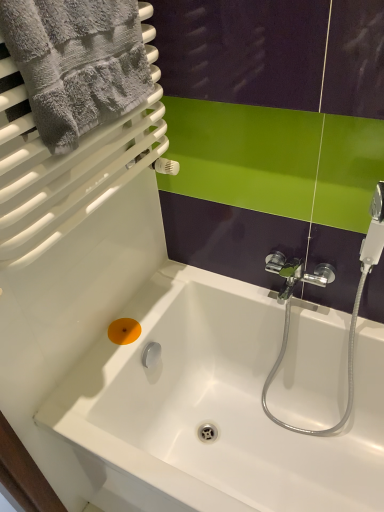
You are a GUI agent. You are given a task and a screenshot of the screen. Output one action in this format:
    pyautogui.click(x=<x>, y=<y>)
    Task: Click on the orange matte soap at lower left
    
    Given the screenshot: What is the action you would take?
    pyautogui.click(x=124, y=331)

The width and height of the screenshot is (384, 512). I want to click on gray fluffy towel at upper left, so click(76, 63).

Between gray fluffy towel at upper left and orange matte soap at lower left, which one is positioned behind?

Positioned behind is orange matte soap at lower left.

Can you confirm if gray fluffy towel at upper left is thinner than orange matte soap at lower left?

No, gray fluffy towel at upper left is not thinner than orange matte soap at lower left.

Measure the distance between gray fluffy towel at upper left and orange matte soap at lower left.

gray fluffy towel at upper left and orange matte soap at lower left are 78.98 centimeters apart.

From the image's perspective, is gray fluffy towel at upper left above or below orange matte soap at lower left?

From the image's perspective, gray fluffy towel at upper left appears above orange matte soap at lower left.

Is gray fluffy towel at upper left located outside white glossy bathtub at center?

Yes, gray fluffy towel at upper left is outside of white glossy bathtub at center.

From the image's perspective, which is above, gray fluffy towel at upper left or white glossy bathtub at center?

gray fluffy towel at upper left.

Can you tell me how much white glossy bathtub at center and gray fluffy towel at upper left differ in facing direction?

They differ by 90 degrees in their facing directions.

From the image's perspective, between white glossy bathtub at center and gray fluffy towel at upper left, which one is located above?

gray fluffy towel at upper left appears higher in the image.

Is white glossy bathtub at center to the left of gray fluffy towel at upper left from the viewer's perspective?

No.

Between white glossy bathtub at center and gray fluffy towel at upper left, which one has smaller size?

Smaller between the two is gray fluffy towel at upper left.

Which object is more forward, orange matte soap at lower left or white glossy bathtub at center?

Positioned in front is white glossy bathtub at center.

Is orange matte soap at lower left situated inside white glossy bathtub at center or outside?

orange matte soap at lower left lies within the bounds of white glossy bathtub at center.

Find the location of a particular element. bathtub located underneath the orange matte soap at lower left (from a real-world perspective) is located at coordinates (217, 406).

From a real-world perspective, is orange matte soap at lower left located higher than white glossy bathtub at center?

Indeed, from a real-world perspective, orange matte soap at lower left stands above white glossy bathtub at center.

Which is more to the left, white glossy bathtub at center or orange matte soap at lower left?

orange matte soap at lower left is more to the left.

Is the depth of white glossy bathtub at center greater than that of orange matte soap at lower left?

No.

From the image's perspective, who appears lower, white glossy bathtub at center or orange matte soap at lower left?

From the image's view, white glossy bathtub at center is below.

Could you tell me if white glossy bathtub at center is turned towards orange matte soap at lower left?

No, white glossy bathtub at center does not turn towards orange matte soap at lower left.

From the image's perspective, is orange matte soap at lower left positioned above or below gray fluffy towel at upper left?

From the image's perspective, orange matte soap at lower left appears below gray fluffy towel at upper left.

Does orange matte soap at lower left appear on the right side of gray fluffy towel at upper left?

Incorrect, orange matte soap at lower left is not on the right side of gray fluffy towel at upper left.

From a real-world perspective, which object stands above the other?

gray fluffy towel at upper left.

Is orange matte soap at lower left oriented away from gray fluffy towel at upper left?

That's not correct — orange matte soap at lower left is not looking away from gray fluffy towel at upper left.

Where is `towel on the right of orange matte soap at lower left`? towel on the right of orange matte soap at lower left is located at coordinates (76, 63).

This screenshot has width=384, height=512. I want to click on towel above the white glossy bathtub at center (from the image's perspective), so click(x=76, y=63).

Considering their positions, is white glossy bathtub at center positioned further to orange matte soap at lower left than gray fluffy towel at upper left?

gray fluffy towel at upper left.

When comparing their distances from gray fluffy towel at upper left, does white glossy bathtub at center or orange matte soap at lower left seem closer?

orange matte soap at lower left lies closer to gray fluffy towel at upper left than the other object.

When comparing their distances from orange matte soap at lower left, does gray fluffy towel at upper left or white glossy bathtub at center seem closer?

Based on the image, white glossy bathtub at center appears to be nearer to orange matte soap at lower left.

Estimate the real-world distances between objects in this image. Which object is closer to gray fluffy towel at upper left, orange matte soap at lower left or white glossy bathtub at center?

Among the two, orange matte soap at lower left is located nearer to gray fluffy towel at upper left.

Based on the photo, from the image, which object appears to be nearer to white glossy bathtub at center, gray fluffy towel at upper left or orange matte soap at lower left?

Based on the image, orange matte soap at lower left appears to be nearer to white glossy bathtub at center.

From the image, which object appears to be farther from white glossy bathtub at center, orange matte soap at lower left or gray fluffy towel at upper left?

gray fluffy towel at upper left is further to white glossy bathtub at center.

This screenshot has width=384, height=512. Find the location of `soap between gray fluffy towel at upper left and white glossy bathtub at center in the vertical direction`. soap between gray fluffy towel at upper left and white glossy bathtub at center in the vertical direction is located at coordinates (124, 331).